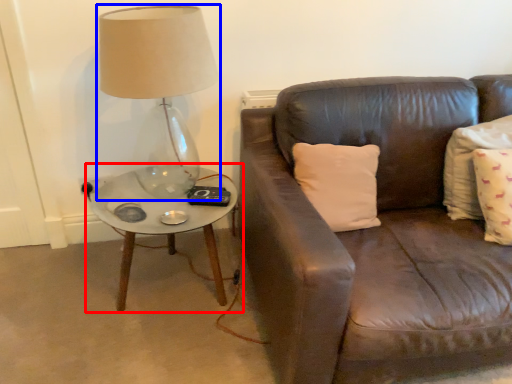
Question: Which object is closer to the camera taking this photo, coffee table (highlighted by a red box) or lamp (highlighted by a blue box)?

Choices:
 (A) coffee table
 (B) lamp

Answer: (B)